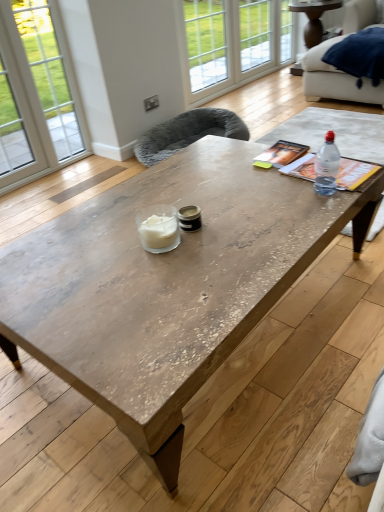
In order to click on vacant position to the left of velvet blue armchair at upper right, arranged as the 2th armchair when ordered from the bottom in this screenshot , I will do `click(258, 100)`.